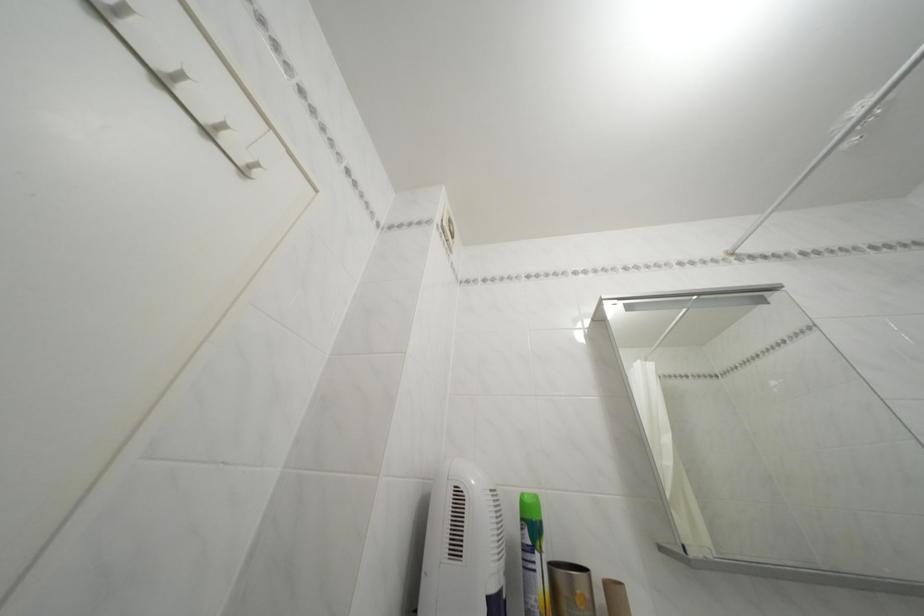
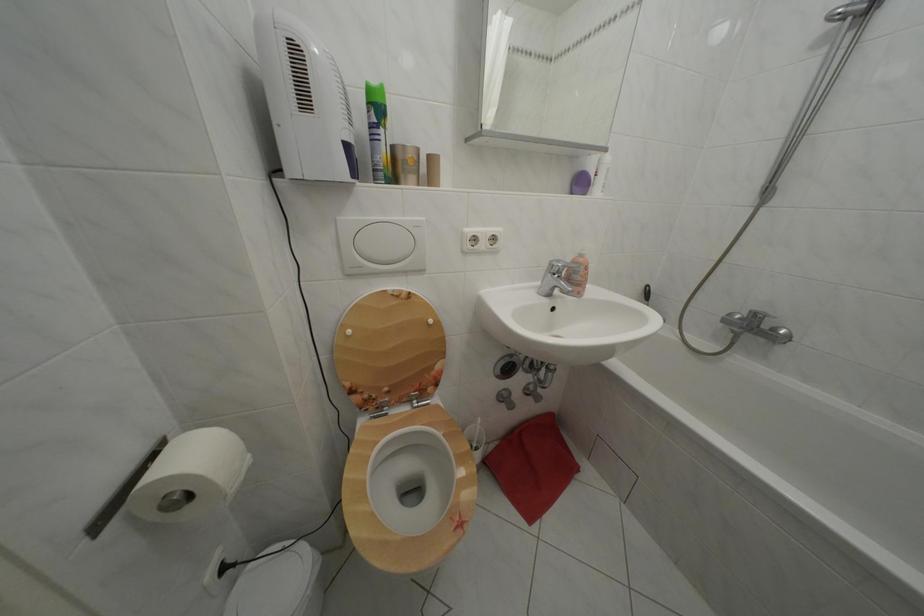
The point at (531, 525) is marked in the first image. Where is the corresponding point in the second image?

(378, 110)